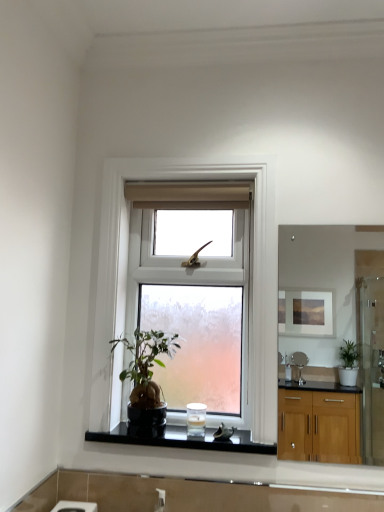
Question: Considering the positions of black glossy stone at center and matte wooden mirror at upper right in the image, is black glossy stone at center wider or thinner than matte wooden mirror at upper right?

Choices:
 (A) thin
 (B) wide

Answer: (B)

Question: From a real-world perspective, is black glossy stone at center above or below matte wooden mirror at upper right?

Choices:
 (A) below
 (B) above

Answer: (A)

Question: Which is farther from the clear glass window at center?

Choices:
 (A) green matte houseplant at center
 (B) white frosted glass candle at center
 (C) black glossy stone at center
 (D) matte wooden mirror at upper right

Answer: (D)

Question: Estimate the real-world distances between objects in this image. Which object is closer to the clear glass window at center?

Choices:
 (A) matte wooden mirror at upper right
 (B) white frosted glass candle at center
 (C) black glossy stone at center
 (D) green matte houseplant at center

Answer: (D)